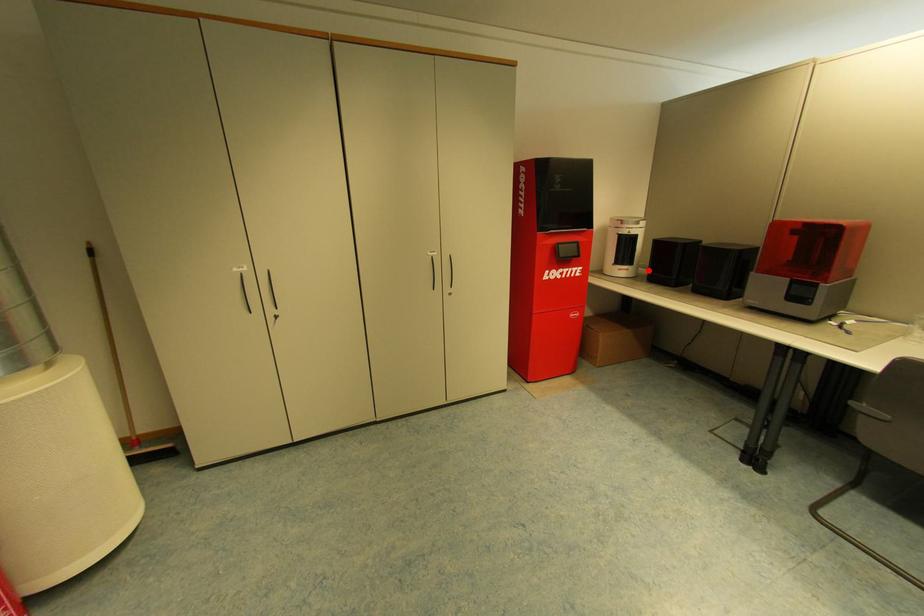
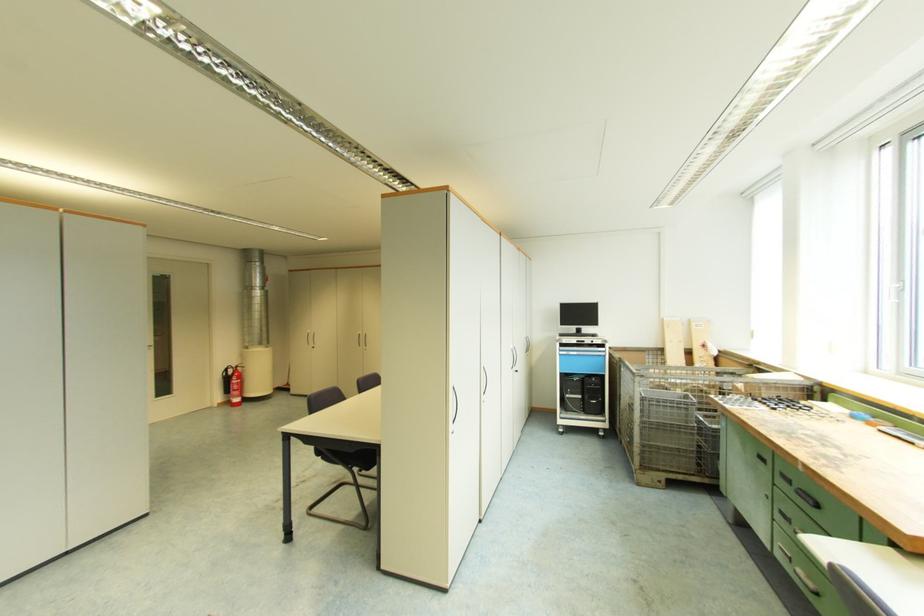
Question: I am providing you with two images of the same scene from different viewpoints. A red point is marked on the first image. Can you still see the location of the red point in image 2?

Choices:
 (A) Yes
 (B) No

Answer: (B)